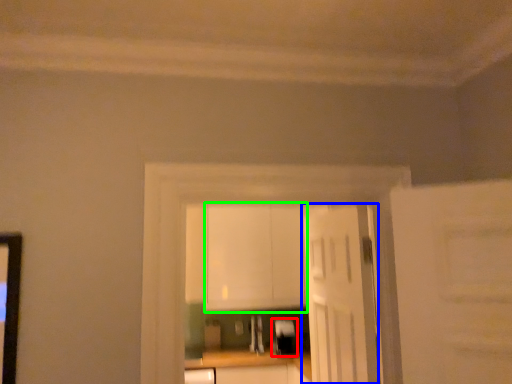
Question: Considering the real-world distances, which object is farthest from appliance (highlighted by a red box)? door (highlighted by a blue box) or cabinetry (highlighted by a green box)?

Choices:
 (A) door
 (B) cabinetry

Answer: (A)